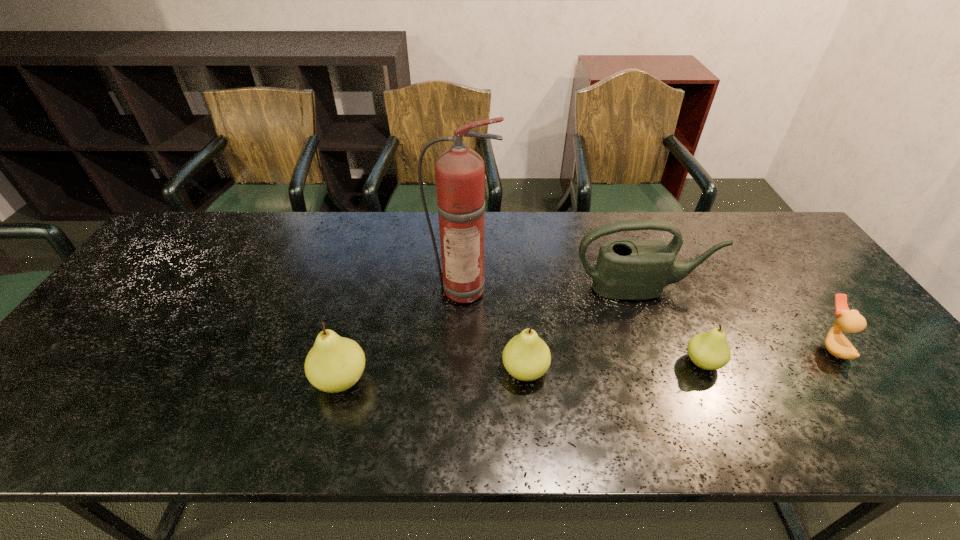
Identify the location of free spot between the second shortest pear and the fire extinguisher. The image size is (960, 540). (494, 329).

Locate which object ranks fourth in proximity to the second shortest pear. Please provide its 2D coordinates. Your answer should be formatted as a tuple, i.e. [(x, y)], where the tuple contains the x and y coordinates of a point satisfying the conditions above.

[(709, 350)]

Point out which object is positioned as the second nearest to the leftmost pear. Please provide its 2D coordinates. Your answer should be formatted as a tuple, i.e. [(x, y)], where the tuple contains the x and y coordinates of a point satisfying the conditions above.

[(526, 357)]

Where is `pear that is the closest to the fire extinguisher`? This screenshot has height=540, width=960. pear that is the closest to the fire extinguisher is located at coordinates (526, 357).

Choose which pear is the second nearest neighbor to the duck. Please provide its 2D coordinates. Your answer should be formatted as a tuple, i.e. [(x, y)], where the tuple contains the x and y coordinates of a point satisfying the conditions above.

[(526, 357)]

Find the location of a particular element. The width and height of the screenshot is (960, 540). free spot that satisfies the following two spatial constraints: 1. on the side of the fourth object from right to left with the label and nozzle; 2. on the left side of the second object from left to right is located at coordinates (461, 371).

You are a GUI agent. You are given a task and a screenshot of the screen. Output one action in this format:
    pyautogui.click(x=<x>, y=<y>)
    Task: Click on the free space that satisfies the following two spatial constraints: 1. on the side of the second tallest pear with the label and nozzle; 2. on the left side of the fire extinguisher
    The image size is (960, 540).
    Given the screenshot: What is the action you would take?
    pyautogui.click(x=461, y=371)